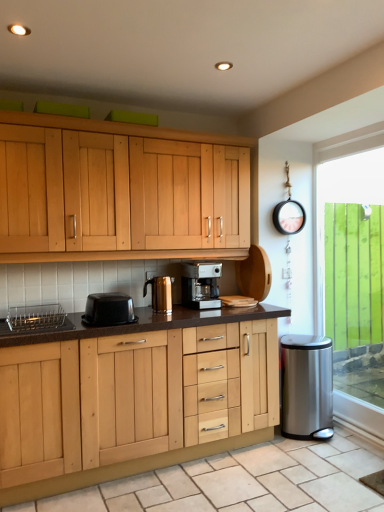
Where is `free space above beige tile at lower center (from a real-world perspective)`? Image resolution: width=384 pixels, height=512 pixels. free space above beige tile at lower center (from a real-world perspective) is located at coordinates (232, 475).